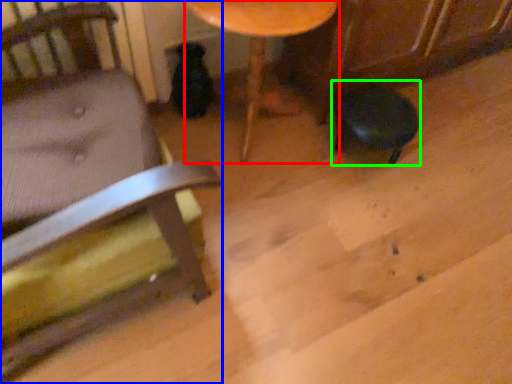
Question: Estimate the real-world distances between objects in this image. Which object is farther from table (highlighted by a red box), chair (highlighted by a blue box) or bar stool (highlighted by a green box)?

Choices:
 (A) chair
 (B) bar stool

Answer: (A)